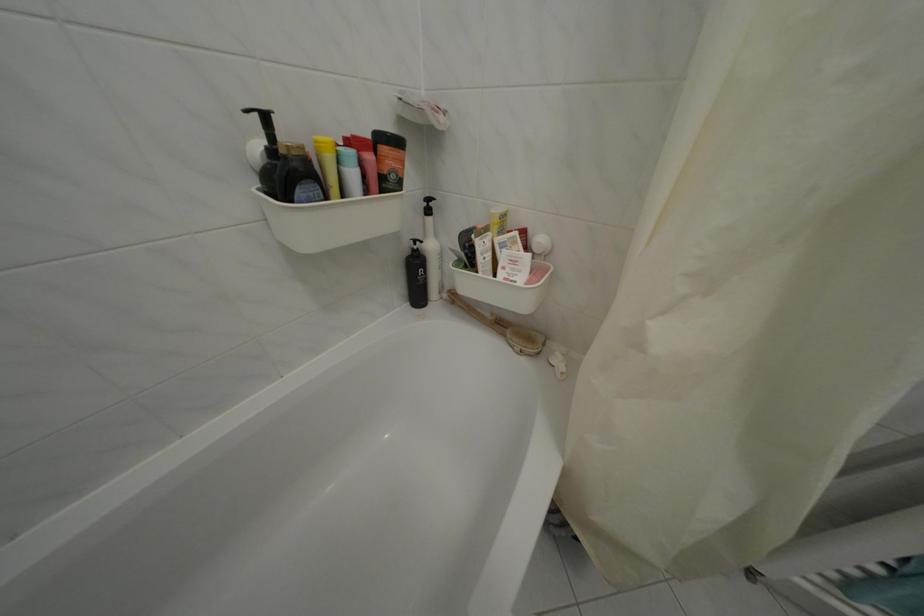
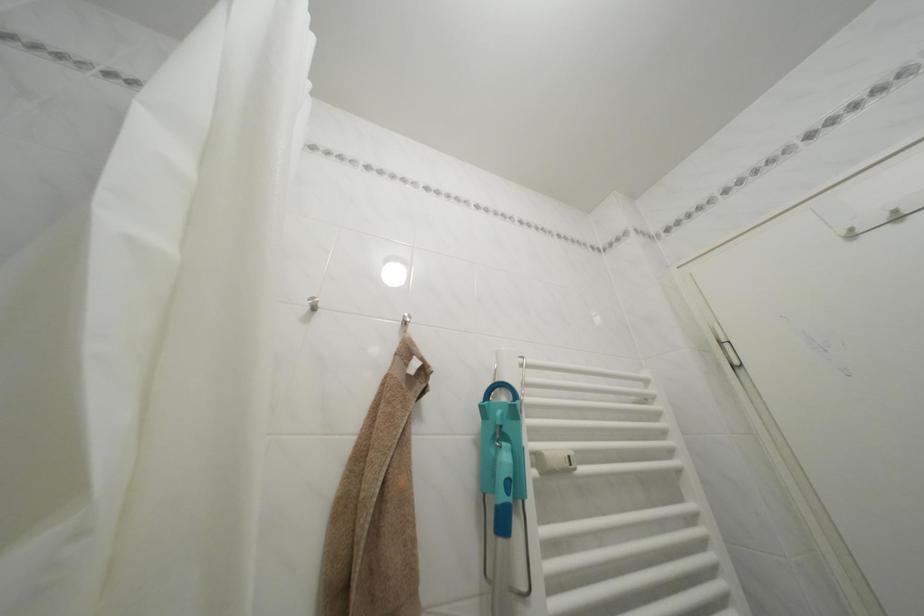
The images are taken continuously from a first-person perspective. In which direction is your viewpoint rotating?

The camera's rotation is toward right-up.